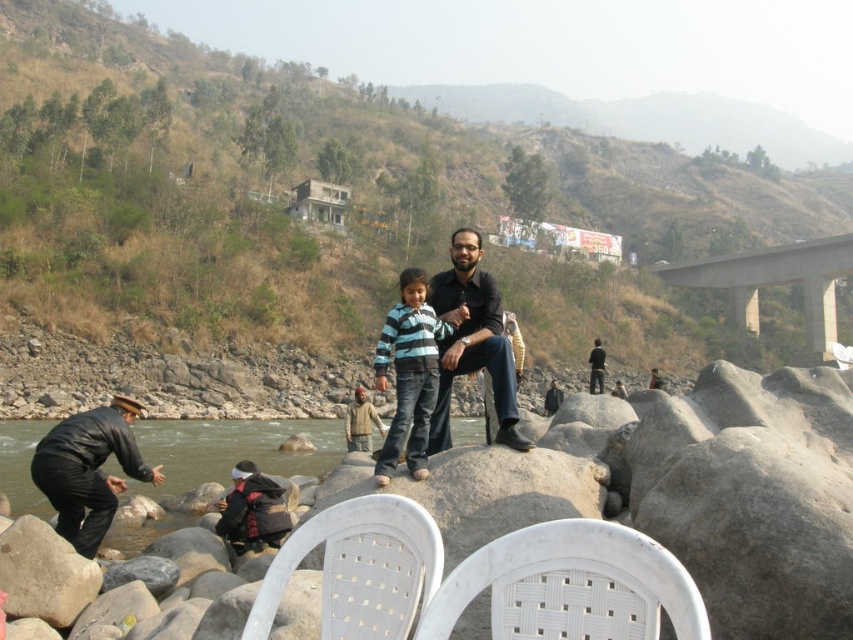
You are a photographer standing at the riverside and notice the black leather jacket at lower left and the matte black shirt at center. Which object is closer to the water?

The black leather jacket at lower left is positioned under matte black shirt at center, so it is closer to the water.

In the scene shown: You are a photographer trying to capture the scene from the riverbank. You notice the clear water at river left and the matte black shirt at center. Which object appears taller in the photo?

The matte black shirt at center appears taller than the clear water at river left in the photo.